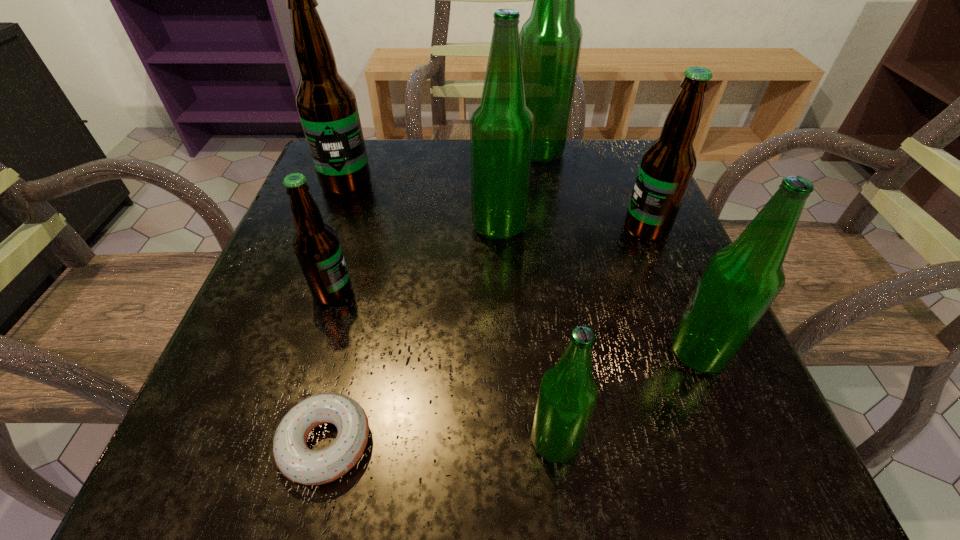
The image size is (960, 540). I want to click on vacant space at the right edge, so click(x=612, y=235).

This screenshot has width=960, height=540. In the image, there is a desktop. What are the coordinates of `vacant area at the far right corner` in the screenshot? It's located at (634, 146).

I want to click on free space between the biggest green beer bottle and the shortest object, so click(432, 298).

The height and width of the screenshot is (540, 960). Identify the location of unoccupied position between the farthest brown beer bottle and the smallest brown beer bottle. (340, 238).

Where is `vacant region between the biggest brown beer bottle and the shortest object`? vacant region between the biggest brown beer bottle and the shortest object is located at coordinates (336, 313).

In order to click on empty space between the doughnut and the smallest green beer bottle in this screenshot , I will do `click(441, 442)`.

Image resolution: width=960 pixels, height=540 pixels. Identify the location of free space that is in between the rightmost brown beer bottle and the second farthest green beer bottle. (572, 228).

Find the location of a particular element. The image size is (960, 540). free space between the rightmost brown beer bottle and the smallest brown beer bottle is located at coordinates (490, 261).

Where is `free spot between the biggest brown beer bottle and the doughnut`? The width and height of the screenshot is (960, 540). free spot between the biggest brown beer bottle and the doughnut is located at coordinates (336, 313).

The image size is (960, 540). I want to click on empty space between the third nearest green beer bottle and the nearest beer bottle, so click(527, 334).